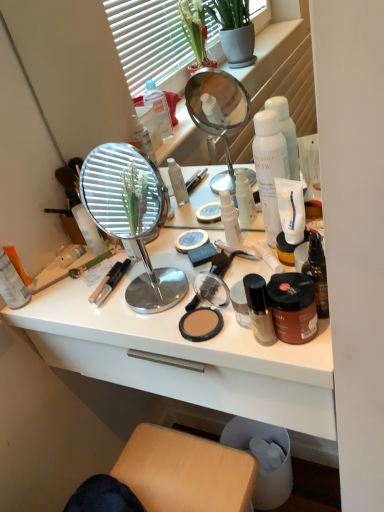
The image size is (384, 512). Find the location of `vacant space that's between matte black brush at lower left and white matte tube at center-right, placed as the first product when sorted from bottom to top`. vacant space that's between matte black brush at lower left and white matte tube at center-right, placed as the first product when sorted from bottom to top is located at coordinates (137, 271).